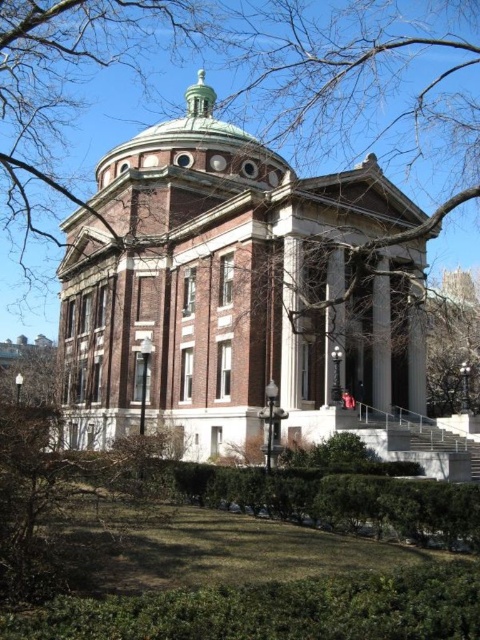
Question: Estimate the real-world distances between objects in this image. Which object is closer to the white marble pillar at center?

Choices:
 (A) green polished dome at center
 (B) white marble column at center

Answer: (B)

Question: Is green polished dome at center to the right of white marble pillar at center from the viewer's perspective?

Choices:
 (A) no
 (B) yes

Answer: (A)

Question: Is white marble pillar at center below white marble column at center?

Choices:
 (A) yes
 (B) no

Answer: (A)

Question: Among these points, which one is nearest to the camera?

Choices:
 (A) (265, 163)
 (B) (283, 339)
 (C) (389, 312)

Answer: (B)

Question: Does green polished dome at center appear on the right side of white marble pillar at center?

Choices:
 (A) yes
 (B) no

Answer: (B)

Question: Which object appears farthest from the camera in this image?

Choices:
 (A) white marble pillar at center
 (B) white marble column at center

Answer: (A)